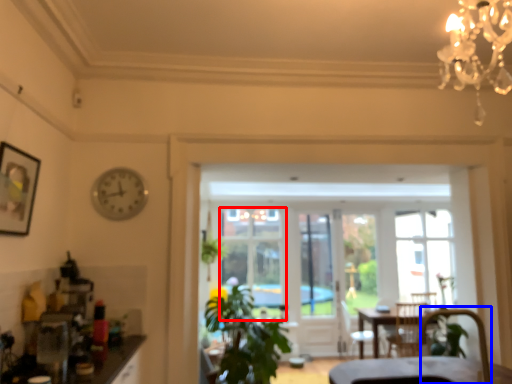
Question: Which of the following is the farthest to the observer, window (highlighted by a red box) or armchair (highlighted by a blue box)?

Choices:
 (A) window
 (B) armchair

Answer: (A)